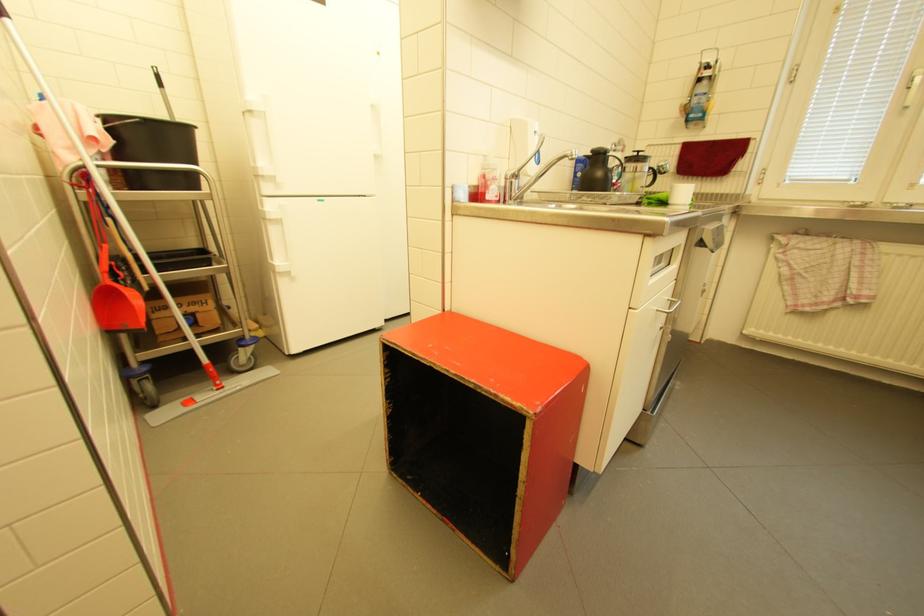
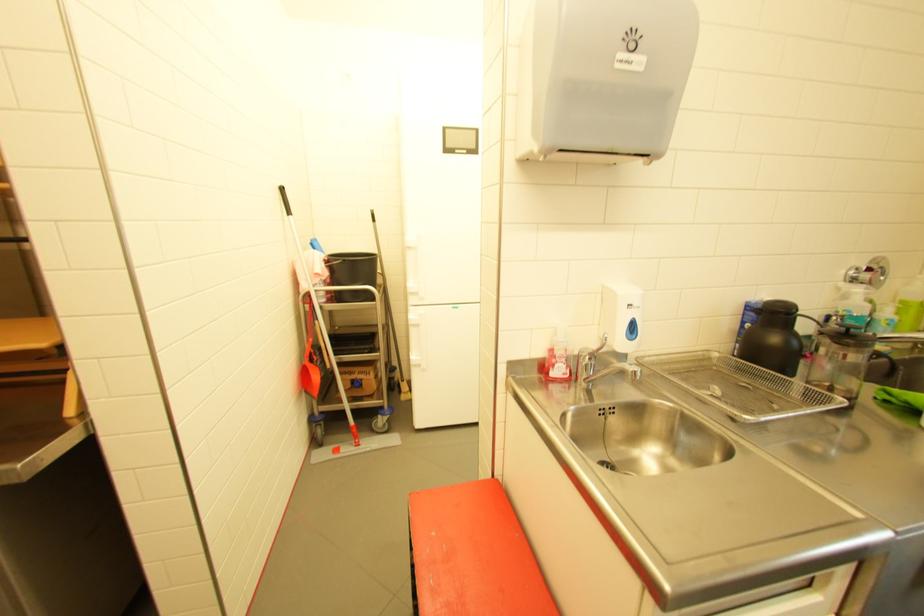
Find the pixel in the second image that matches point 606,175 in the first image.

(782, 339)